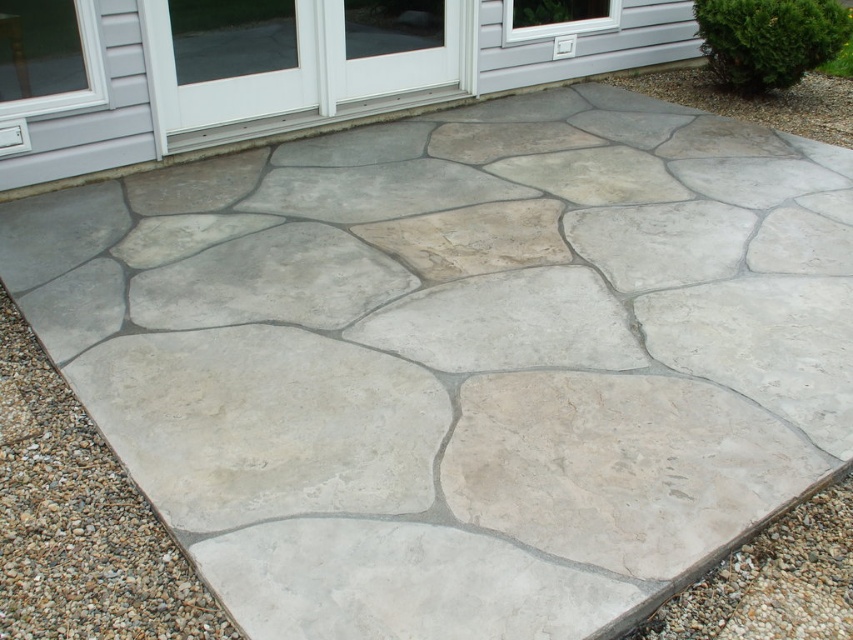
You are standing on the stone patio and want to walk to the front door of the house, which is located at the bottom right corner. You see gray gravel at lower left and gray gravel at bottom right. Which direction should you head to reach the door?

You should head towards the gray gravel at bottom right because the front door is located at the bottom right corner, and the gray gravel at lower left is positioned to the left of it.

You are standing on the stone patio and want to walk to the house entrance located behind the gray gravel at bottom right. Which direction should you walk to avoid stepping on the gray gravel at lower left?

You should walk towards the gray gravel at bottom right while avoiding the gray gravel at lower left, as the gray gravel at lower left is in front of the gray gravel at bottom right, meaning it is closer to you. By moving towards the gray gravel at bottom right, you can bypass the gray gravel at lower left which is blocking your path.